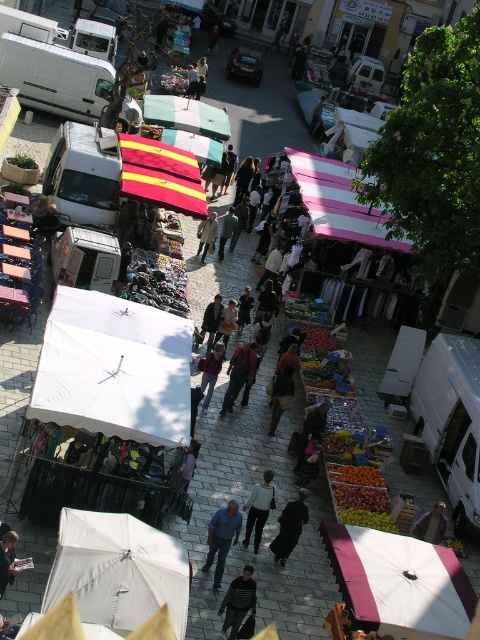
Does blue denim jeans at center come in front of denim jacket at center?

Yes, it is in front of denim jacket at center.

Does blue denim jeans at center have a lesser height compared to denim jacket at center?

No, blue denim jeans at center is not shorter than denim jacket at center.

Does point (222, 524) lie in front of point (211, 371)?

That is True.

Identify the location of blue denim jeans at center. (222, 538).

Between dark blue jeans at center and dark gray jacket at center, which one is positioned lower?

dark blue jeans at center

Is point (231, 404) farther from camera compared to point (205, 323)?

No, it is not.

Which is behind, point (228, 394) or point (213, 314)?

Positioned behind is point (213, 314).

Where is `dark blue jeans at center`? This screenshot has height=640, width=480. dark blue jeans at center is located at coordinates (238, 374).

Does white cotton sweater at center have a greater height compared to light brown leather jacket at center?

In fact, white cotton sweater at center may be shorter than light brown leather jacket at center.

Does point (257, 522) lie in front of point (235, 220)?

Yes, point (257, 522) is closer to viewer.

Is point (266, 504) positioned behind point (227, 227)?

No, it is not.

Locate an element on the screen. This screenshot has width=480, height=640. white cotton sweater at center is located at coordinates (259, 508).